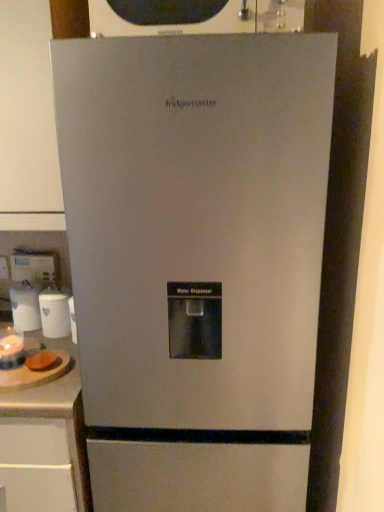
Question: Is the position of brown bread at left more distant than that of white glossy water dispenser at center, which is the 3th appliance in front-to-back order?

Choices:
 (A) yes
 (B) no

Answer: (B)

Question: From a real-world perspective, is brown bread at left over white glossy water dispenser at center, which is the 3th appliance in front-to-back order?

Choices:
 (A) no
 (B) yes

Answer: (A)

Question: Does brown bread at left touch white glossy water dispenser at center, which is the 3th appliance in front-to-back order?

Choices:
 (A) yes
 (B) no

Answer: (B)

Question: Is brown bread at left at the left side of white glossy water dispenser at center, which is the 3th appliance in front-to-back order?

Choices:
 (A) yes
 (B) no

Answer: (B)

Question: Does brown bread at left appear on the right side of white glossy water dispenser at center, acting as the 1th appliance starting from the back?

Choices:
 (A) yes
 (B) no

Answer: (A)

Question: Considering the relative sizes of brown bread at left and white glossy water dispenser at center, which is the 3th appliance in front-to-back order, in the image provided, is brown bread at left taller than white glossy water dispenser at center, which is the 3th appliance in front-to-back order,?

Choices:
 (A) no
 (B) yes

Answer: (A)

Question: Is matte glass candle at lower left, which appears as the third appliance when viewed from the back, wider than wooden cutting board at lower left?

Choices:
 (A) yes
 (B) no

Answer: (B)

Question: From a real-world perspective, does matte glass candle at lower left, which is the 1th appliance from front to back, sit lower than wooden cutting board at lower left?

Choices:
 (A) no
 (B) yes

Answer: (A)

Question: From the image's perspective, does matte glass candle at lower left, which appears as the third appliance when viewed from the back, appear higher than wooden cutting board at lower left?

Choices:
 (A) yes
 (B) no

Answer: (A)

Question: Is matte glass candle at lower left, which appears as the third appliance when viewed from the back, completely or partially outside of wooden cutting board at lower left?

Choices:
 (A) yes
 (B) no

Answer: (A)

Question: Considering the relative sizes of matte glass candle at lower left, which appears as the third appliance when viewed from the back, and wooden cutting board at lower left in the image provided, is matte glass candle at lower left, which appears as the third appliance when viewed from the back, bigger than wooden cutting board at lower left?

Choices:
 (A) no
 (B) yes

Answer: (A)

Question: Is the surface of matte glass candle at lower left, which is the 1th appliance from front to back, in direct contact with wooden cutting board at lower left?

Choices:
 (A) yes
 (B) no

Answer: (B)

Question: From a real-world perspective, is white glossy water dispenser at center, which is the 3th appliance in front-to-back order, over brown bread at left?

Choices:
 (A) no
 (B) yes

Answer: (B)